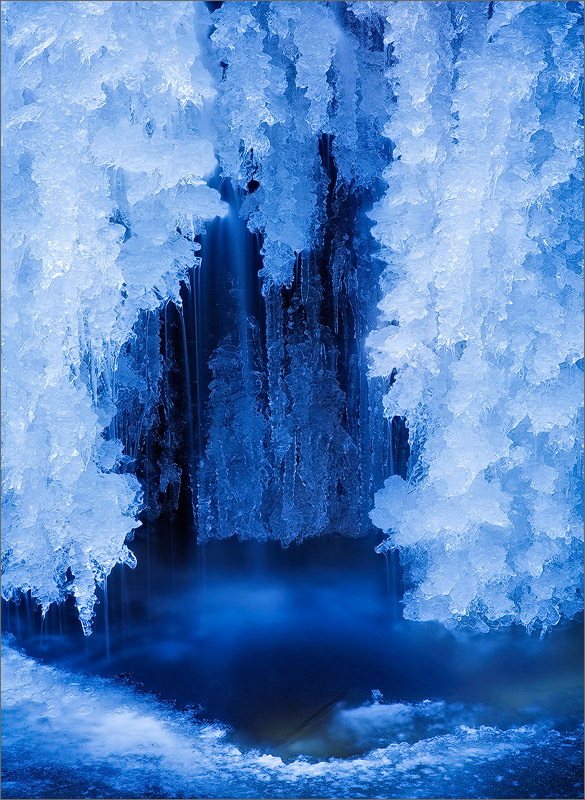
At what (x,y) coordinates should I click in order to perform the action: click on corners. Please return your answer as a coordinate pair (x, y). Looking at the image, I should click on (0, 0), (1, 794), (580, 794), (581, 2).